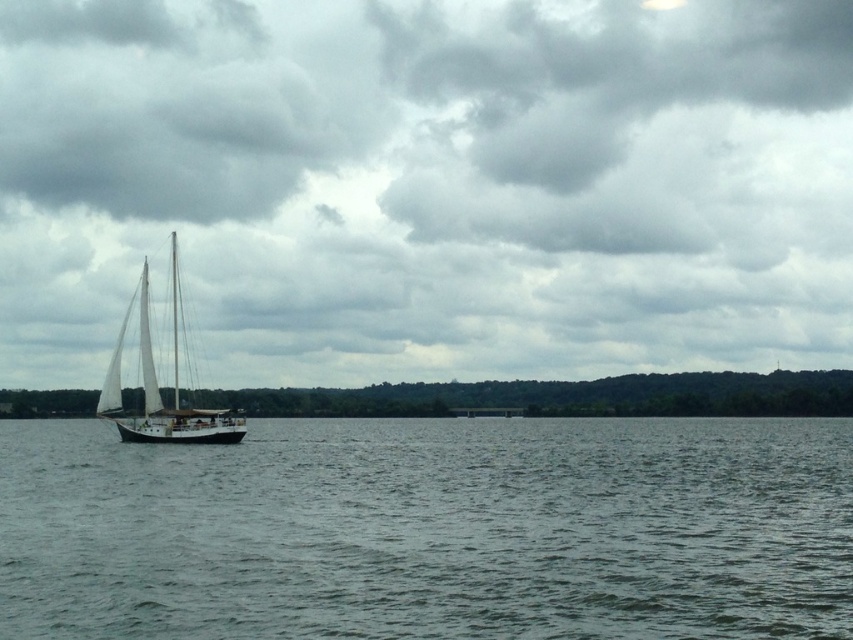
Is gray water at center wider than white matte sailboat at left?

Yes.

Can you confirm if gray water at center is positioned above white matte sailboat at left?

No, gray water at center is not above white matte sailboat at left.

Does point (30, 636) lie in front of point (190, 433)?

Yes.

Image resolution: width=853 pixels, height=640 pixels. I want to click on gray water at center, so click(x=428, y=529).